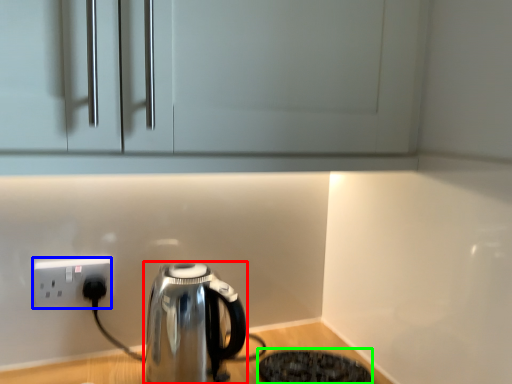
Question: Based on their relative distances, which object is nearer to kettle (highlighted by a red box)? Choose from power plugs and sockets (highlighted by a blue box) and appliance (highlighted by a green box).

Choices:
 (A) power plugs and sockets
 (B) appliance

Answer: (B)